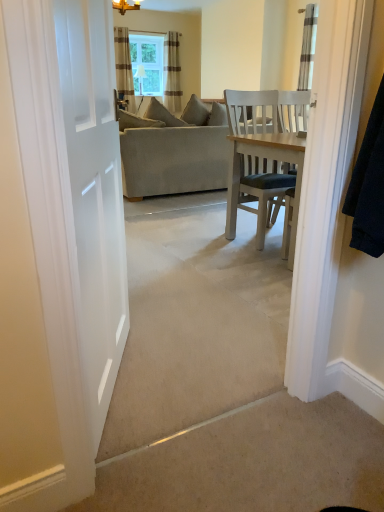
Question: Choose the correct answer: Is clear glass window at upper center inside beige fabric couch at center or outside it?

Choices:
 (A) inside
 (B) outside

Answer: (B)

Question: From a real-world perspective, is clear glass window at upper center above or below beige fabric couch at center?

Choices:
 (A) below
 (B) above

Answer: (B)

Question: Based on their relative distances, which object is farther from the clear glass window at upper center?

Choices:
 (A) striped fabric curtain at upper right, which ranks as the first curtain in right-to-left order
 (B) beige fabric couch at center
 (C) striped fabric curtain at upper center, which is the 3th curtain in front-to-back order
 (D) striped fabric curtain at upper center, which is the 3th curtain in right-to-left order

Answer: (B)

Question: Based on their relative distances, which object is farther from the striped fabric curtain at upper right, which ranks as the first curtain in right-to-left order?

Choices:
 (A) striped fabric curtain at upper center, acting as the first curtain starting from the back
 (B) clear glass window at upper center
 (C) beige fabric couch at center
 (D) striped fabric curtain at upper center, which is counted as the 2th curtain, starting from the back

Answer: (D)